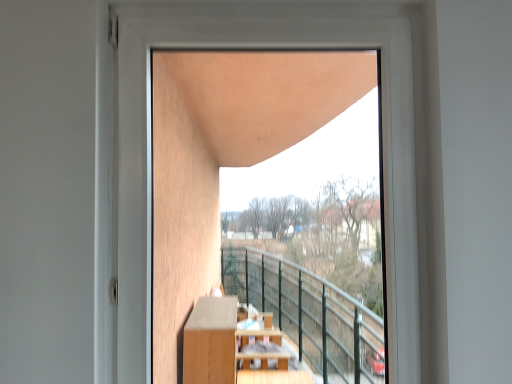
At what (x,y) coordinates should I click in order to perform the action: click on transparent glass window at center. Please return your answer as a coordinate pair (x, y). Image resolution: width=512 pixels, height=384 pixels. Looking at the image, I should click on (265, 47).

Describe the element at coordinates (265, 47) in the screenshot. I see `transparent glass window at center` at that location.

Where is `transparent glass window at center`? This screenshot has width=512, height=384. transparent glass window at center is located at coordinates (265, 47).